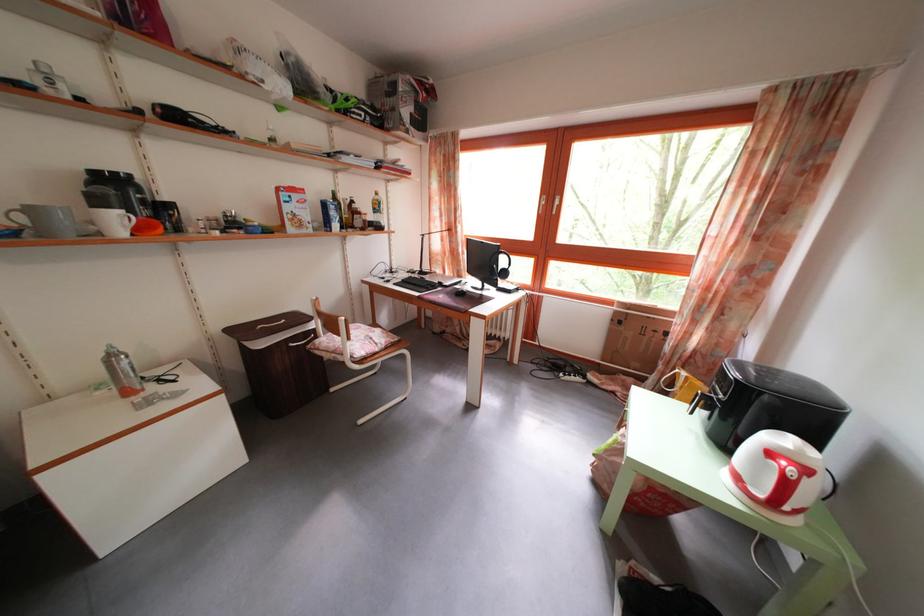
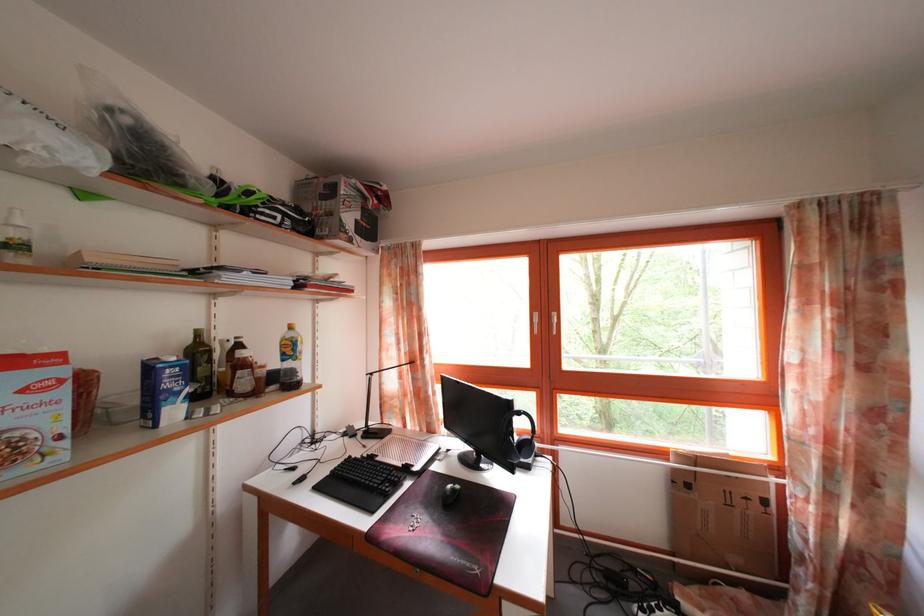
First-person continuous shooting, in which direction is the camera rotating?

The rotation direction of the camera is right-up.